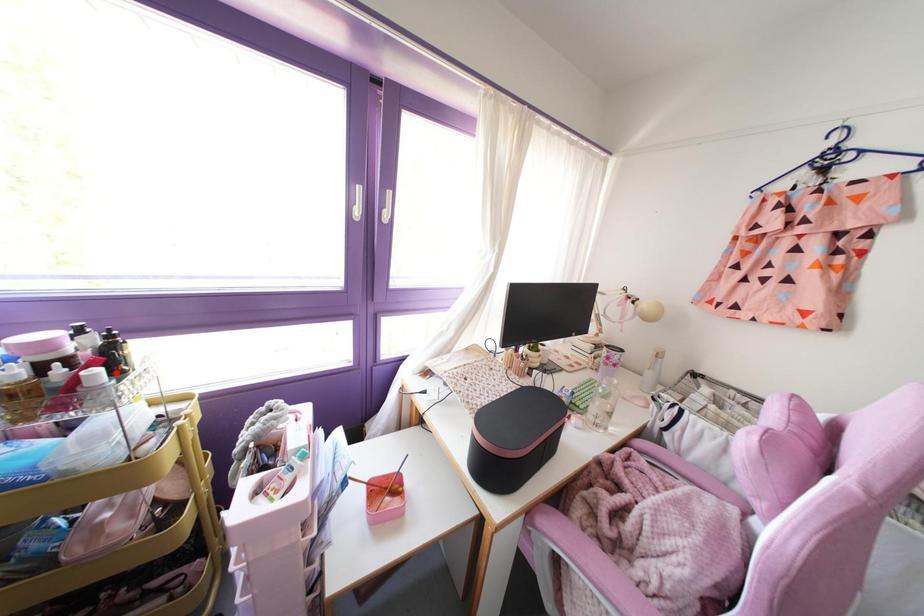
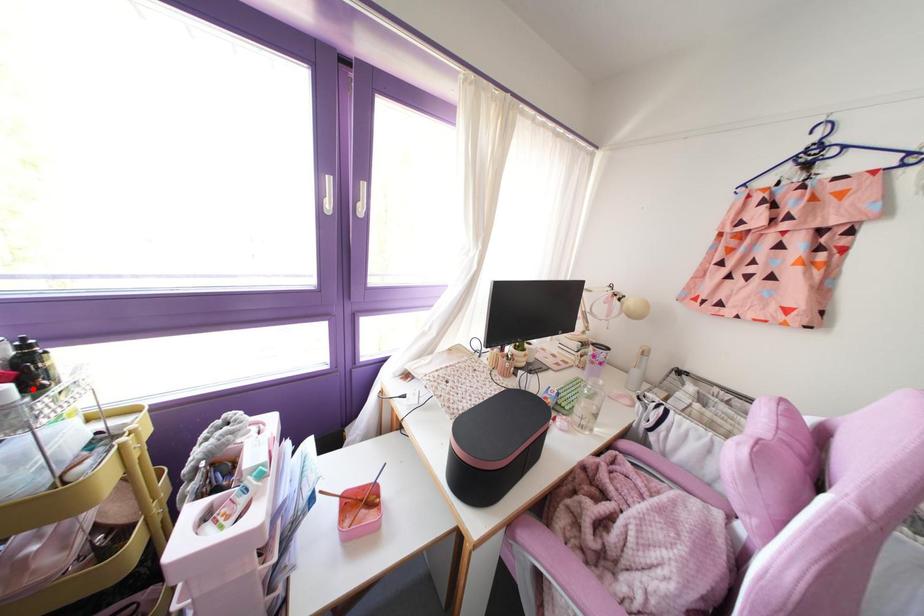
I am providing you with two images of the same scene from different viewpoints. A red point is marked on the first image and another point is marked on the second image. Does the point marked in image1 correspond to the same location as the one in image2?

Yes